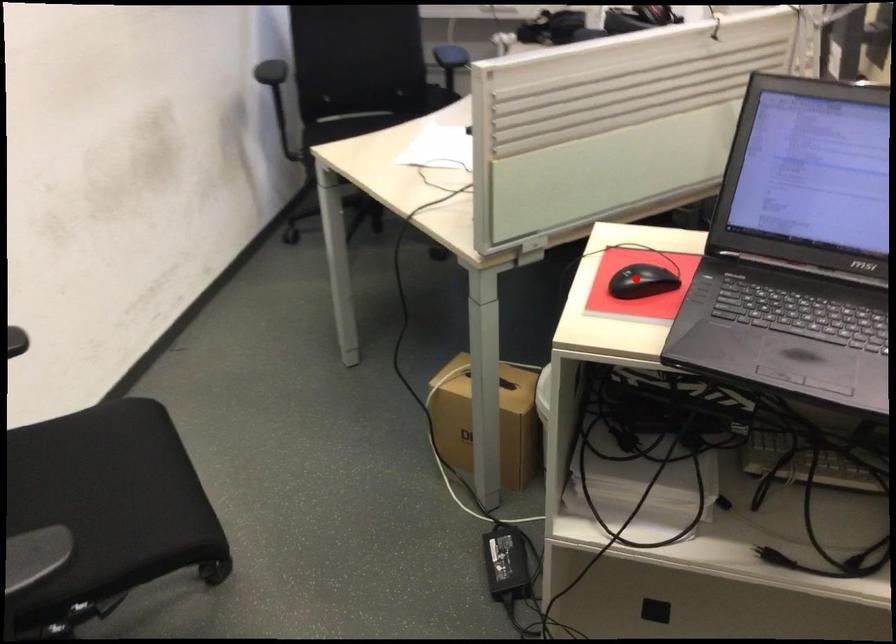
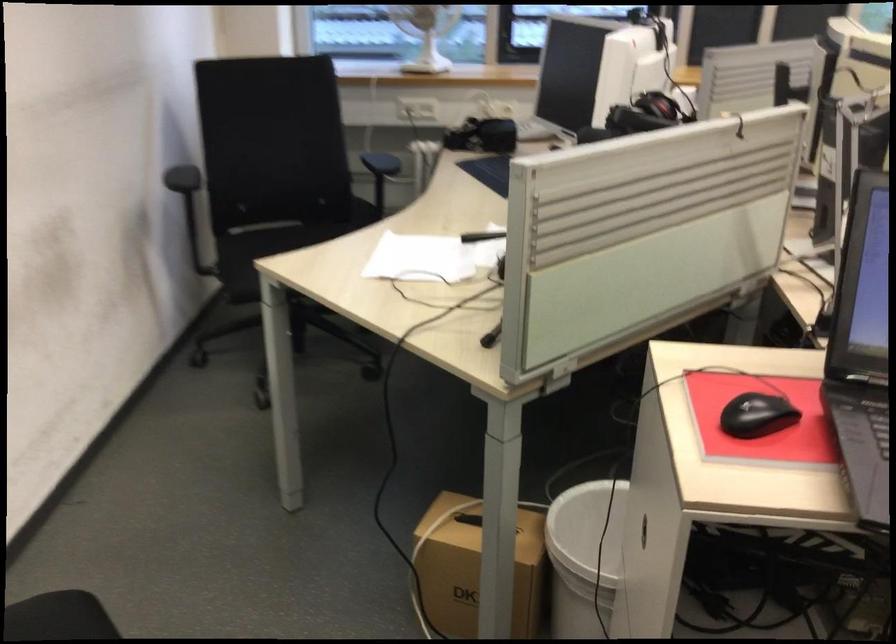
Question: I am providing you with two images of the same scene from different viewpoints. In image1, a red point is highlighted. Considering the same 3D point in image2, which of the following is correct?

Choices:
 (A) It is closer
 (B) It is farther

Answer: (A)